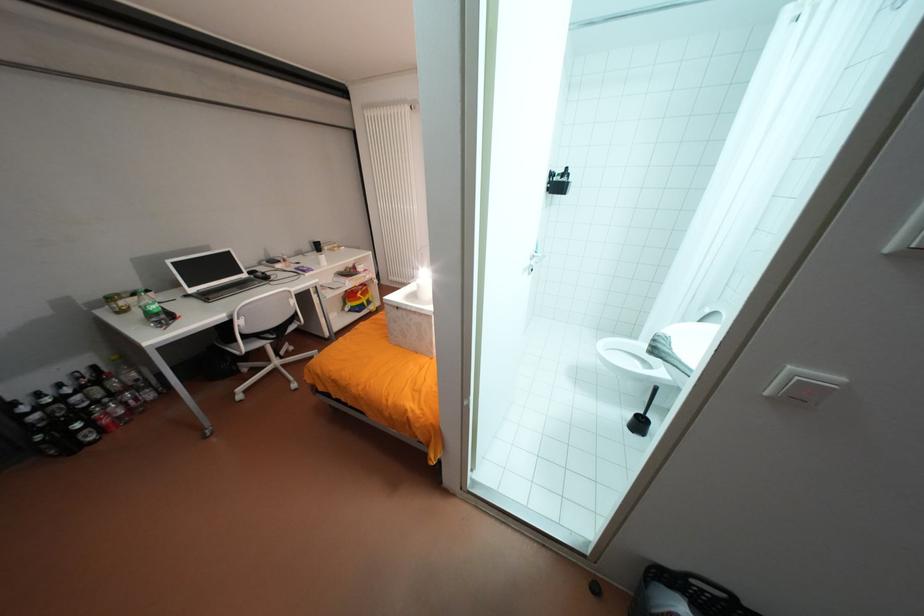
The width and height of the screenshot is (924, 616). What are the coordinates of `white candle` in the screenshot? It's located at (423, 284).